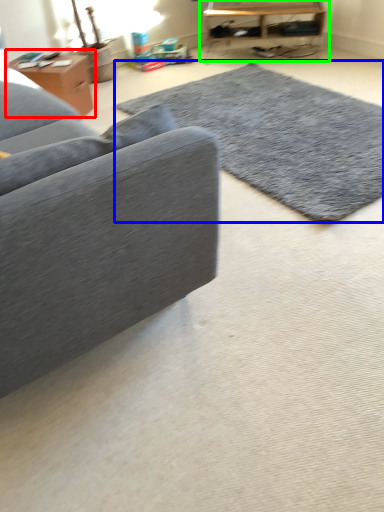
Question: Considering the real-world distances, which object is farthest from table (highlighted by a red box)? mat (highlighted by a blue box) or table (highlighted by a green box)?

Choices:
 (A) mat
 (B) table

Answer: (B)